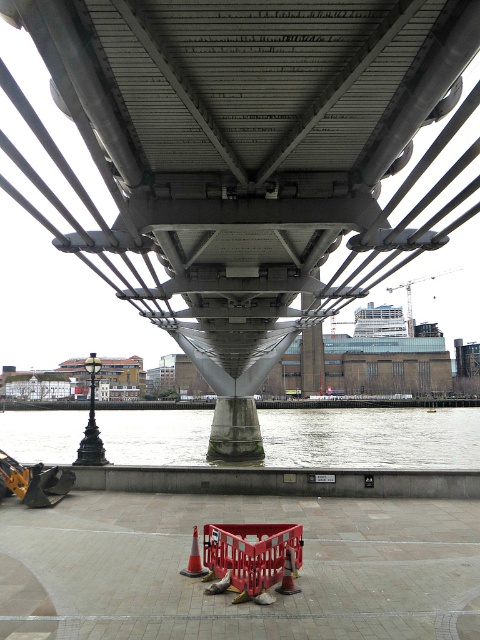
Based on the photo, between metallic gray bridge at center and gray concrete water at lower center, which one has more height?

With more height is metallic gray bridge at center.

Can you confirm if metallic gray bridge at center is bigger than gray concrete water at lower center?

Yes, metallic gray bridge at center is bigger than gray concrete water at lower center.

This screenshot has width=480, height=640. Identify the location of metallic gray bridge at center. (247, 163).

Is metallic gray bridge at center positioned before red plastic barricade at center?

Yes, metallic gray bridge at center is in front of red plastic barricade at center.

Is metallic gray bridge at center to the right of red plastic barricade at center from the viewer's perspective?

No, metallic gray bridge at center is not to the right of red plastic barricade at center.

Is point (446, 67) closer to viewer compared to point (255, 573)?

Yes.

The image size is (480, 640). I want to click on metallic gray bridge at center, so click(x=247, y=163).

Can you confirm if red plastic barricade at center is shorter than orange matte traffic cone at lower center?

In fact, red plastic barricade at center may be taller than orange matte traffic cone at lower center.

Which is in front, point (233, 540) or point (197, 566)?

Point (233, 540) is more forward.

Which is behind, point (225, 529) or point (193, 570)?

Positioned behind is point (225, 529).

Locate an element on the screen. The height and width of the screenshot is (640, 480). red plastic barricade at center is located at coordinates (251, 552).